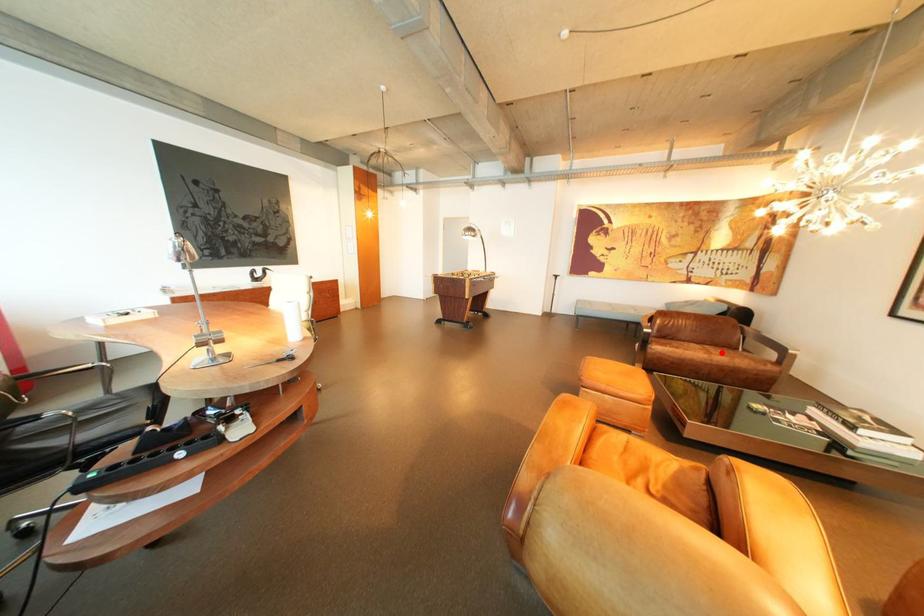
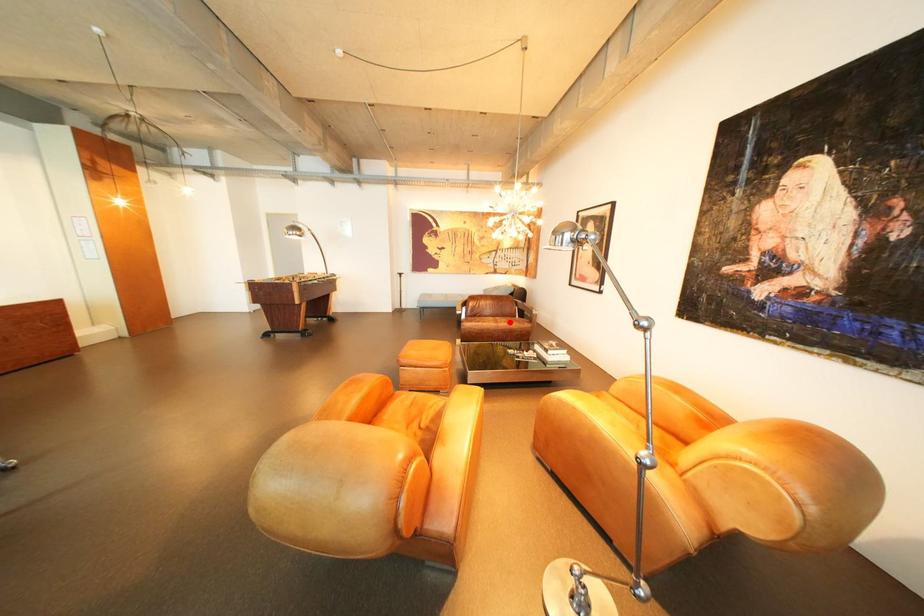
I am providing you with two images of the same scene from different viewpoints. A red point is marked on the first image and another point is marked on the second image. Does the point marked in image1 correspond to the same location as the one in image2?

Yes